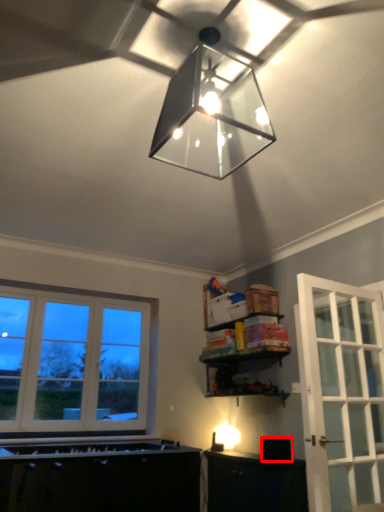
Question: From the image, what is the correct spatial relationship of appliance (annotated by the red box) in relation to lamp?

Choices:
 (A) left
 (B) right

Answer: (B)